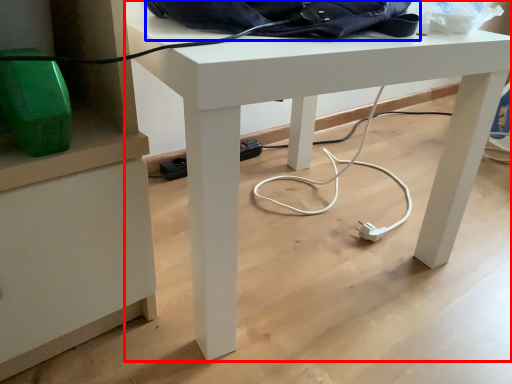
Question: Which point is further to the camera, desk (highlighted by a red box) or messenger bag (highlighted by a blue box)?

Choices:
 (A) desk
 (B) messenger bag

Answer: (B)